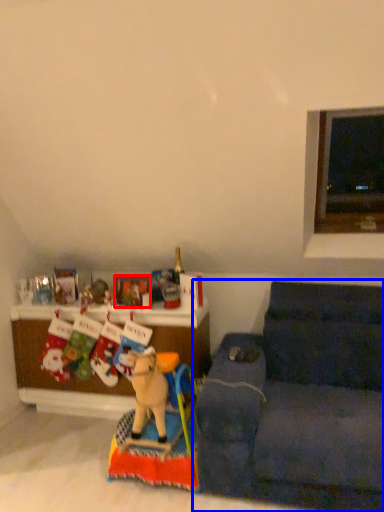
Question: Which object is closer to the camera taking this photo, picture frame (highlighted by a red box) or studio couch (highlighted by a blue box)?

Choices:
 (A) picture frame
 (B) studio couch

Answer: (B)